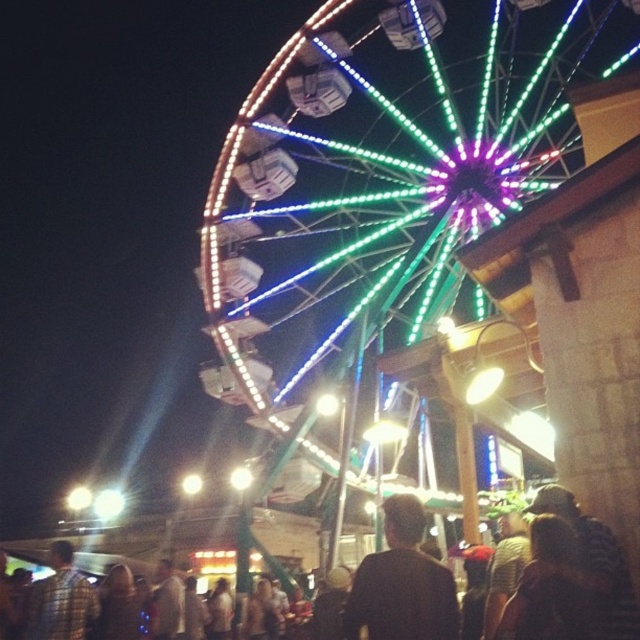
You are at the fairground and want to find the person wearing the plaid shirt at lower left. Which direction should you look relative to the person in the black matte shirt at center?

The black matte shirt at center is above the plaid shirt at lower left, so you should look downward from the black matte shirt at center to find the plaid shirt at lower left.

You are at the fairground and want to find the shortest person between the black matte shirt at center and the plaid shirt at lower left. Which one should you look for?

The black matte shirt at center has a smaller size compared to plaid shirt at lower left, so the shortest person is the black matte shirt at center.

You are standing at the point marked as point (364, 252) and want to walk to the Ferris wheel. The Ferris wheel is 109.95 meters away from you. If you walk at a speed of 1.5 meters per second, how long will it take you to reach the Ferris wheel?

The distance between you and the Ferris wheel is 109.95 meters. At a walking speed of 1.5 meters per second, it will take approximately 73.3 seconds to reach the Ferris wheel.